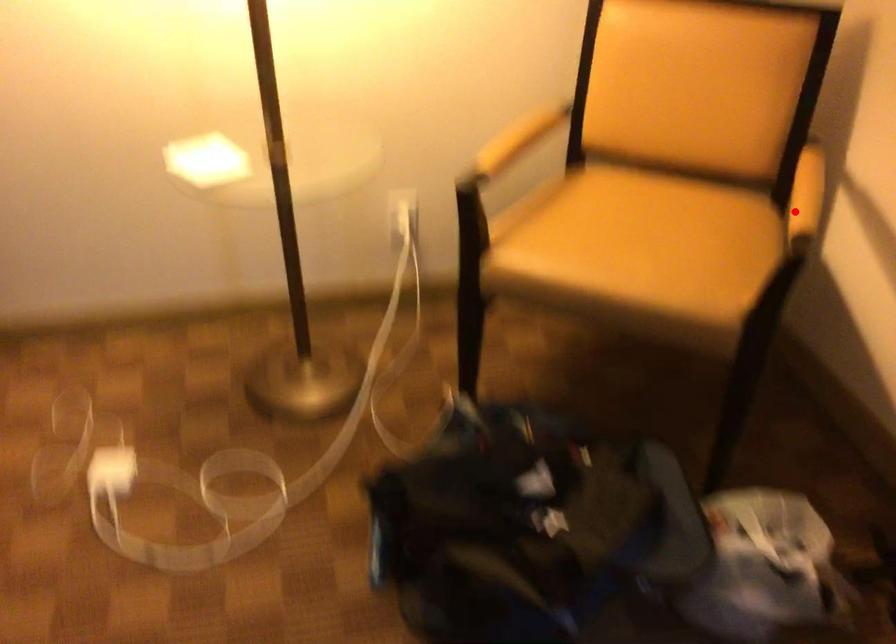
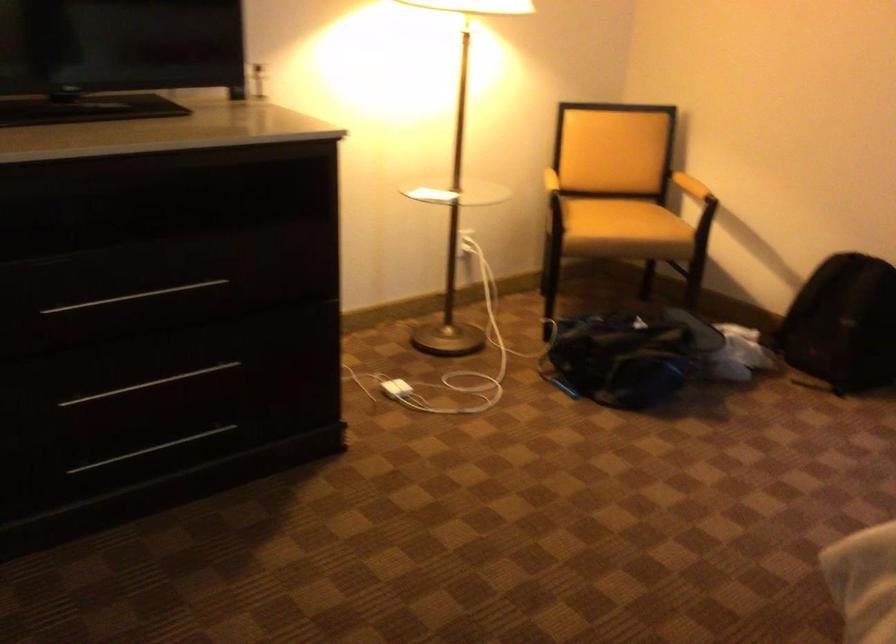
Question: I am providing you with two images of the same scene from different viewpoints. A red point is shown in image1. For the corresponding object point in image2, is it positioned nearer or farther from the camera?

Choices:
 (A) Nearer
 (B) Farther

Answer: (B)